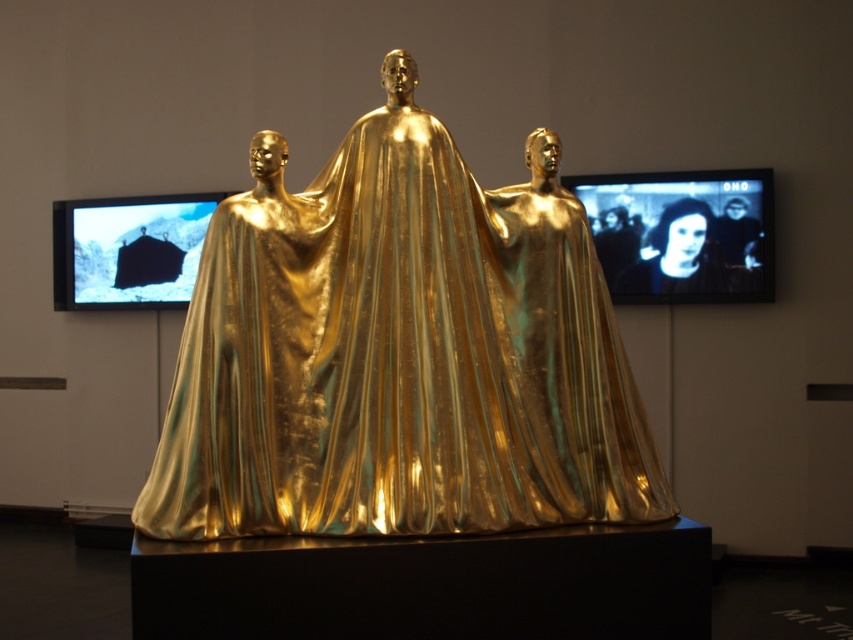
You are an art critic standing in front of the sculpture. You notice two points on the sculpture marked as point (636,289) and point (732,257). Which point is closer to your eyes?

Point (732,257) is closer to your eyes because it is less further to the camera than point (636,289).

You are an art critic standing in front of the sculpture. You notice two faces on the sculpture, the smooth black face at upper center and the black glossy face at upper center. Which face do you see first when looking at the sculpture?

You will see the smooth black face at upper center first because it is closer to the viewer than the black glossy face at upper center.